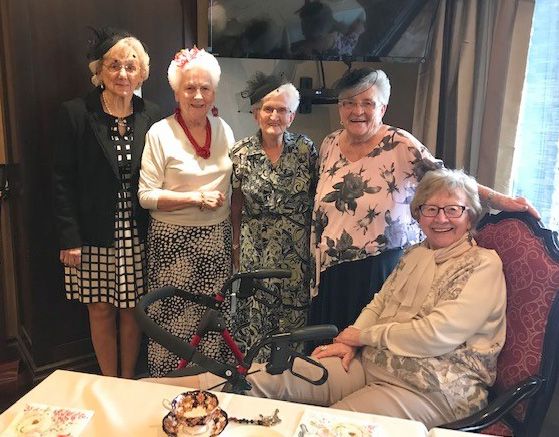
I want to click on cup, so click(x=203, y=400).